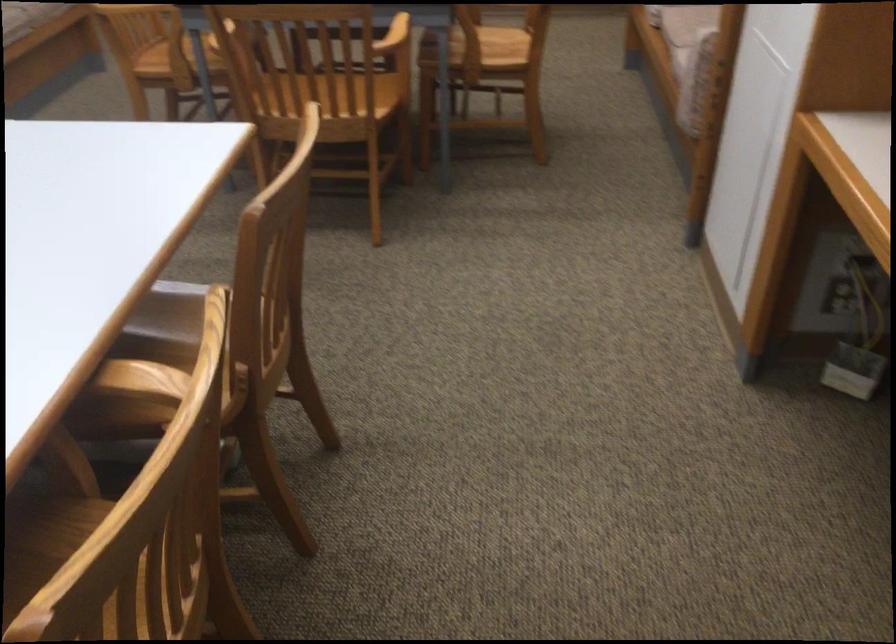
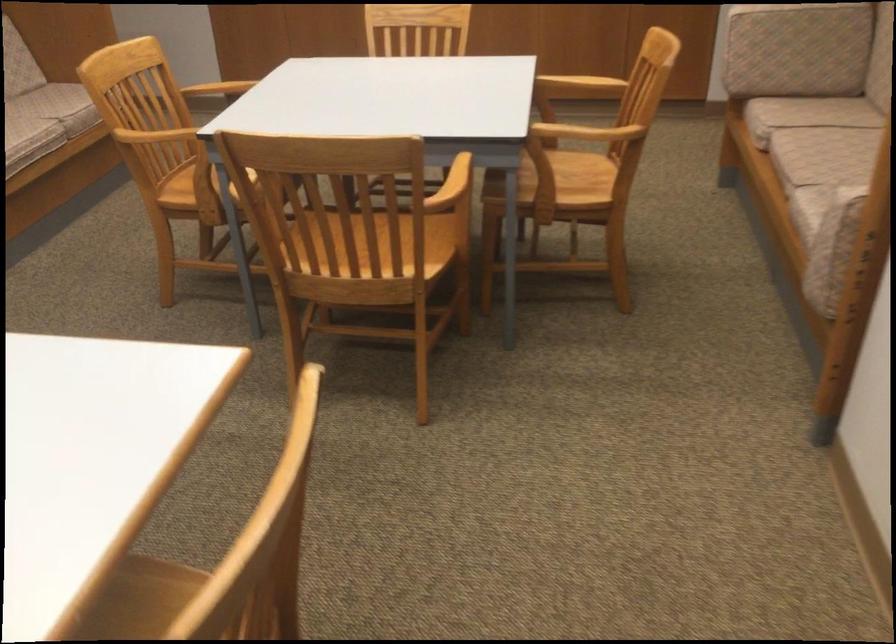
Question: The images are taken continuously from a first-person perspective. In which direction is your viewpoint rotating?

Choices:
 (A) Left
 (B) Right
 (C) Up
 (D) Down

Answer: (C)